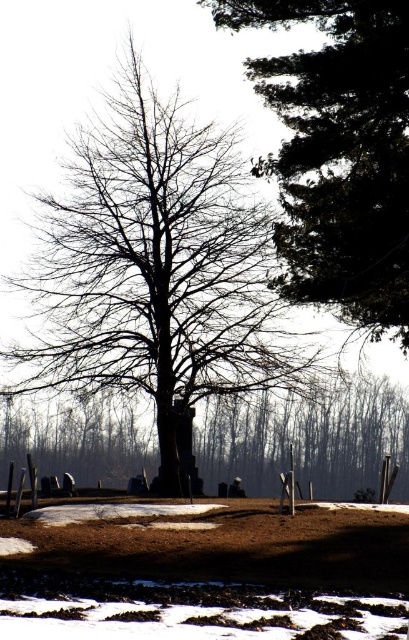
You are an artist sketching the winter scene. You need to decide which object to draw first based on their sizes. Which one should you start with, the bare wood tree at center or the smooth brown tree trunk at center?

The bare wood tree at center is larger in size than the smooth brown tree trunk at center, so you should start with the bare wood tree at center to ensure proper scaling and placement in your sketch.

You are an artist trying to sketch this winter scene. You want to ensure the dark green textured tree at upper right and the smooth brown tree trunk at center are proportionally accurate. Which of these two trees should you draw larger in your sketch?

The dark green textured tree at upper right should be drawn larger than the smooth brown tree trunk at center because it is bigger according to the description.

You are a landscape architect planning to plant a new tree in the cemetery. The new tree must be placed exactly 5 meters away from the dark green textured tree at upper right. Can the current position of the bare wood tree at center be used as the location for the new tree?

The distance between the bare wood tree at center and the dark green textured tree at upper right is 7.27 meters, which is more than 5 meters. Therefore, the current position of the bare wood tree at center cannot be used as the location for the new tree since it exceeds the required 5 meters distance.